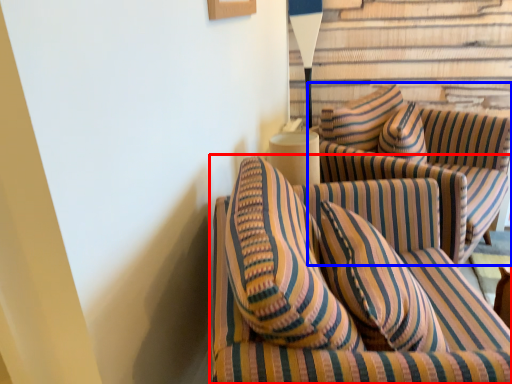
Question: Which of the following is the farthest to the observer, studio couch (highlighted by a red box) or studio couch (highlighted by a blue box)?

Choices:
 (A) studio couch
 (B) studio couch

Answer: (B)